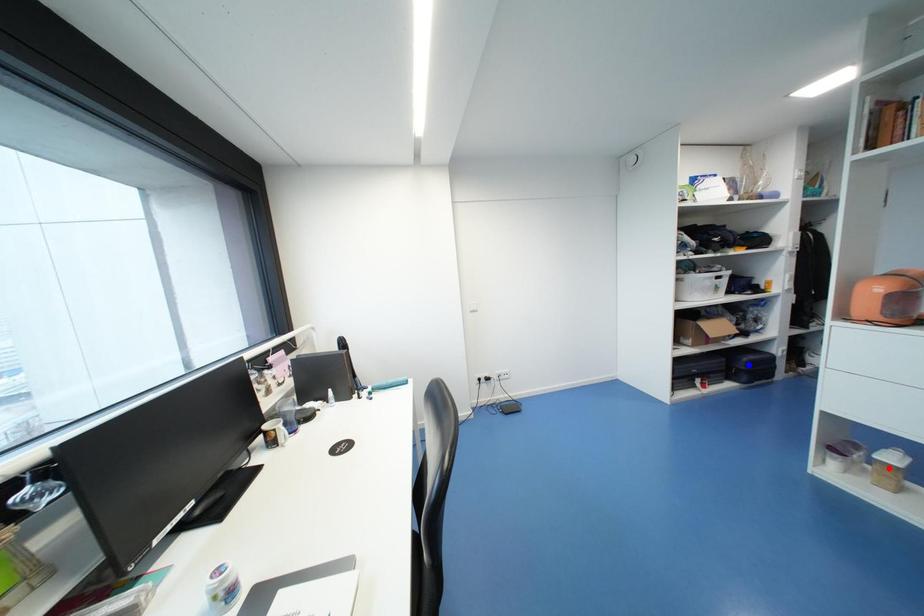
Question: Which of the two points in the image is closer to the camera?

Choices:
 (A) Blue point is closer.
 (B) Red point is closer.

Answer: (B)